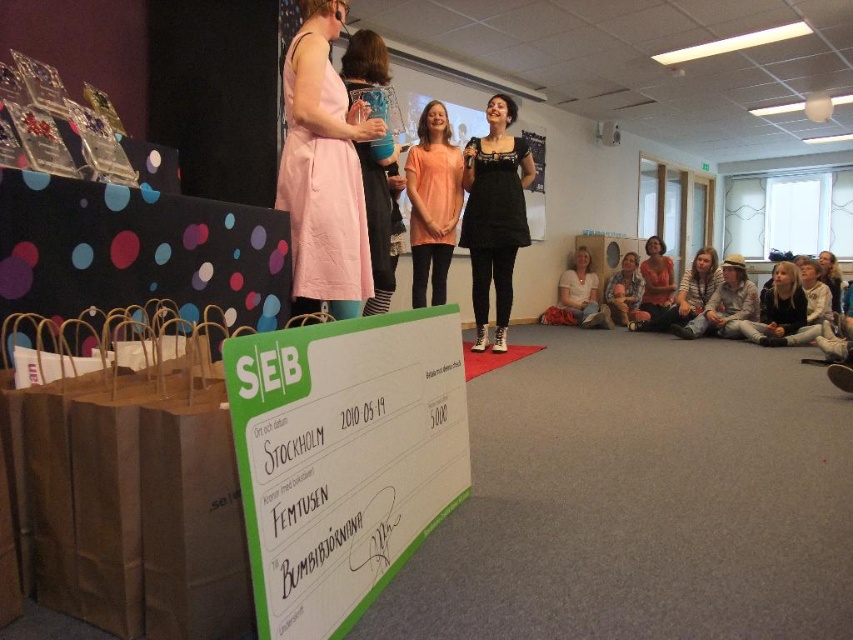
Question: Is pink fabric dress at center smaller than striped sweater at lower right?

Choices:
 (A) no
 (B) yes

Answer: (A)

Question: Based on their relative distances, which object is nearer to the green paper sign at center?

Choices:
 (A) black matte dress at center
 (B) pink fabric dress at center

Answer: (B)

Question: Which object is positioned closest to the green paper sign at center?

Choices:
 (A) pink fabric dress at center
 (B) striped sweater at lower right

Answer: (A)

Question: Observing the image, what is the correct spatial positioning of pink fabric dress at upper left in reference to striped sweater at lower right?

Choices:
 (A) above
 (B) below

Answer: (A)

Question: Estimate the real-world distances between objects in this image. Which object is closer to the matte peach t-shirt at center?

Choices:
 (A) striped sweater at lower right
 (B) matte pink dress at lower center

Answer: (A)

Question: Is green paper sign at center wider than pink fabric dress at upper left?

Choices:
 (A) no
 (B) yes

Answer: (A)